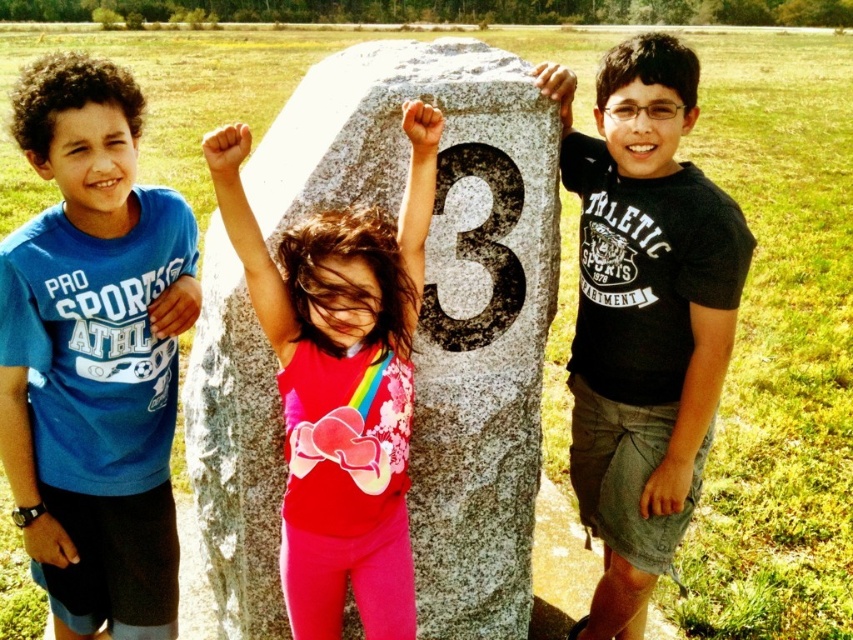
Question: Among these points, which one is nearest to the camera?

Choices:
 (A) (341, 465)
 (B) (636, 550)
 (C) (103, 458)

Answer: (A)

Question: Is matte pink leggings at center further to camera compared to white textured number at center?

Choices:
 (A) yes
 (B) no

Answer: (B)

Question: Estimate the real-world distances between objects in this image. Which object is farther from the black cotton t-shirt at center?

Choices:
 (A) blue t-shirt at left
 (B) matte pink leggings at center

Answer: (A)

Question: Considering the real-world distances, which object is farthest from the white textured number at center?

Choices:
 (A) matte pink leggings at center
 (B) blue t-shirt at left
 (C) black cotton t-shirt at center

Answer: (B)

Question: Does black cotton t-shirt at center appear on the right side of white textured number at center?

Choices:
 (A) no
 (B) yes

Answer: (B)

Question: Is matte pink leggings at center below white textured number at center?

Choices:
 (A) yes
 (B) no

Answer: (A)